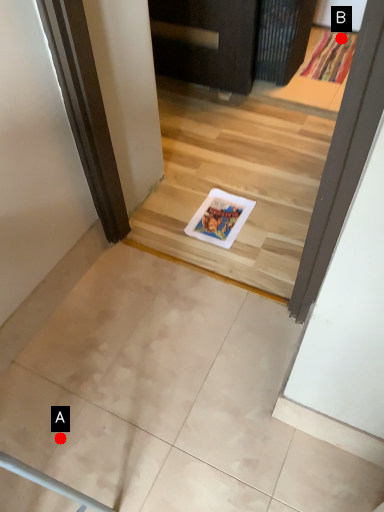
Question: Two points are circled on the image, labeled by A and B beside each circle. Which point is closer to the camera taking this photo?

Choices:
 (A) A is closer
 (B) B is closer

Answer: (A)